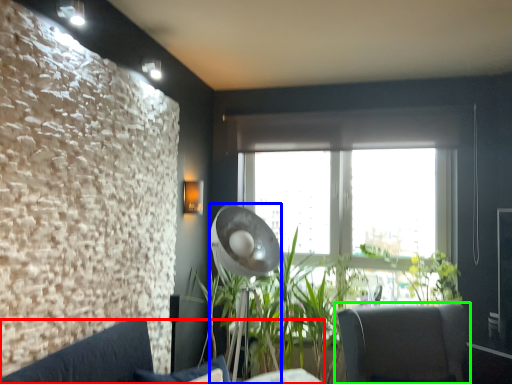
Question: Considering the real-world distances, which object is farthest from studio couch (highlighted by a red box)? lamp (highlighted by a blue box) or chair (highlighted by a green box)?

Choices:
 (A) lamp
 (B) chair

Answer: (B)